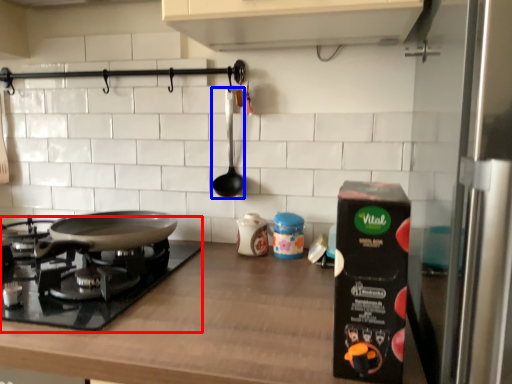
Question: Among these objects, which one is farthest to the camera, gas stove (highlighted by a red box) or utensil (highlighted by a blue box)?

Choices:
 (A) gas stove
 (B) utensil

Answer: (B)